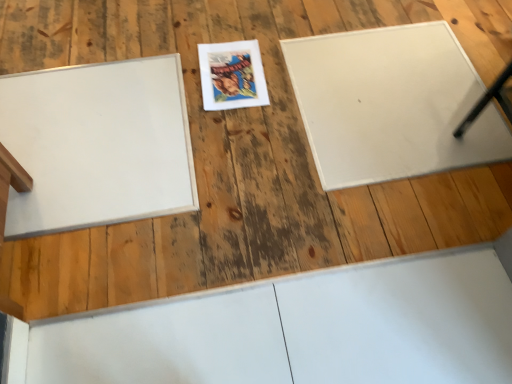
The height and width of the screenshot is (384, 512). What do you see at coordinates (390, 104) in the screenshot?
I see `white matte board at upper right, which is the 2th bulletin board in left-to-right order` at bounding box center [390, 104].

Locate an element on the screen. white matte board at left, which appears as the 2th bulletin board when viewed from the right is located at coordinates (98, 144).

What do you see at coordinates (232, 75) in the screenshot? The width and height of the screenshot is (512, 384). I see `matte paper comic book at center` at bounding box center [232, 75].

In order to face matte paper comic book at center, should I rotate leftwards or rightwards?

A 3.031 degree turn to the left will do.

Locate an element on the screen. This screenshot has height=384, width=512. white matte board at upper right, which is the 2th bulletin board in left-to-right order is located at coordinates (390, 104).

Is white matte board at upper right, which appears as the 1th bulletin board when viewed from the right, not near white matte board at left, which appears as the 2th bulletin board when viewed from the right?

No, white matte board at upper right, which appears as the 1th bulletin board when viewed from the right, is in close proximity to white matte board at left, which appears as the 2th bulletin board when viewed from the right.

Find the location of a particular element. This screenshot has height=384, width=512. bulletin board below the white matte board at upper right, which is the 2th bulletin board in left-to-right order (from the image's perspective) is located at coordinates (98, 144).

Between white matte board at upper right, which appears as the 1th bulletin board when viewed from the right, and white matte board at left, which appears as the 2th bulletin board when viewed from the right, which one has larger size?

With larger size is white matte board at upper right, which appears as the 1th bulletin board when viewed from the right.

From the picture: Does white matte board at upper right, which appears as the 1th bulletin board when viewed from the right, appear on the right side of white matte board at left, which is the first bulletin board in left-to-right order?

Yes.

Can you confirm if matte paper comic book at center is bigger than white matte board at left, which is the first bulletin board in left-to-right order?

Incorrect, matte paper comic book at center is not larger than white matte board at left, which is the first bulletin board in left-to-right order.

What's the angular difference between matte paper comic book at center and white matte board at left, which is the first bulletin board in left-to-right order,'s facing directions?

The facing directions of matte paper comic book at center and white matte board at left, which is the first bulletin board in left-to-right order, are 1.59 degrees apart.

Which object is wider, matte paper comic book at center or white matte board at left, which appears as the 2th bulletin board when viewed from the right?

white matte board at left, which appears as the 2th bulletin board when viewed from the right.

Would you say matte paper comic book at center is a long distance from white matte board at left, which appears as the 2th bulletin board when viewed from the right?

matte paper comic book at center is near white matte board at left, which appears as the 2th bulletin board when viewed from the right, not far away.

Is white matte board at upper right, which appears as the 1th bulletin board when viewed from the right, oriented away from matte paper comic book at center?

That's not correct — white matte board at upper right, which appears as the 1th bulletin board when viewed from the right, is not looking away from matte paper comic book at center.

Which of these two, white matte board at upper right, which is the 2th bulletin board in left-to-right order, or matte paper comic book at center, is wider?

white matte board at upper right, which is the 2th bulletin board in left-to-right order, is wider.

There is a white matte board at upper right, which is the 2th bulletin board in left-to-right order. Find the location of `comic book above it (from a real-world perspective)`. comic book above it (from a real-world perspective) is located at coordinates (232, 75).

What's the angular difference between white matte board at upper right, which appears as the 1th bulletin board when viewed from the right, and matte paper comic book at center's facing directions?

white matte board at upper right, which appears as the 1th bulletin board when viewed from the right, and matte paper comic book at center are facing 2.42 degrees away from each other.

Which is closer to the camera, [227,58] or [343,78]?

The point [343,78] is more forward.

From the image's perspective, is matte paper comic book at center over white matte board at upper right, which is the 2th bulletin board in left-to-right order?

Correct, matte paper comic book at center appears higher than white matte board at upper right, which is the 2th bulletin board in left-to-right order, in the image.

Is there a large distance between matte paper comic book at center and white matte board at upper right, which appears as the 1th bulletin board when viewed from the right?

They are positioned close to each other.

Is white matte board at left, which is the first bulletin board in left-to-right order, at the left side of white matte board at upper right, which appears as the 1th bulletin board when viewed from the right?

Yes, white matte board at left, which is the first bulletin board in left-to-right order, is to the left of white matte board at upper right, which appears as the 1th bulletin board when viewed from the right.

Are white matte board at left, which is the first bulletin board in left-to-right order, and white matte board at upper right, which appears as the 1th bulletin board when viewed from the right, beside each other?

white matte board at left, which is the first bulletin board in left-to-right order, and white matte board at upper right, which appears as the 1th bulletin board when viewed from the right, are clearly separated.

At what (x,y) coordinates should I click in order to perform the action: click on bulletin board on the right side of white matte board at left, which appears as the 2th bulletin board when viewed from the right. Please return your answer as a coordinate pair (x, y). The width and height of the screenshot is (512, 384). Looking at the image, I should click on (390, 104).

Who is bigger, white matte board at left, which is the first bulletin board in left-to-right order, or white matte board at upper right, which is the 2th bulletin board in left-to-right order?

white matte board at upper right, which is the 2th bulletin board in left-to-right order, is bigger.

Between white matte board at left, which appears as the 2th bulletin board when viewed from the right, and matte paper comic book at center, which one is positioned behind?

Positioned behind is matte paper comic book at center.

Are white matte board at left, which is the first bulletin board in left-to-right order, and matte paper comic book at center beside each other?

No.

From the image's perspective, between white matte board at left, which is the first bulletin board in left-to-right order, and matte paper comic book at center, which one is located above?

matte paper comic book at center, from the image's perspective.

Can you confirm if white matte board at left, which appears as the 2th bulletin board when viewed from the right, is wider than matte paper comic book at center?

Correct, the width of white matte board at left, which appears as the 2th bulletin board when viewed from the right, exceeds that of matte paper comic book at center.

Identify the location of bulletin board behind the white matte board at left, which appears as the 2th bulletin board when viewed from the right. (390, 104).

Locate an element on the screen. Image resolution: width=512 pixels, height=384 pixels. bulletin board that is on the left side of matte paper comic book at center is located at coordinates (98, 144).

Based on their spatial positions, is white matte board at left, which appears as the 2th bulletin board when viewed from the right, or matte paper comic book at center closer to white matte board at upper right, which is the 2th bulletin board in left-to-right order?

matte paper comic book at center is positioned closer to the anchor white matte board at upper right, which is the 2th bulletin board in left-to-right order.

Estimate the real-world distances between objects in this image. Which object is closer to white matte board at upper right, which is the 2th bulletin board in left-to-right order, matte paper comic book at center or white matte board at left, which appears as the 2th bulletin board when viewed from the right?

matte paper comic book at center is positioned closer to the anchor white matte board at upper right, which is the 2th bulletin board in left-to-right order.

Looking at the image, which one is located closer to white matte board at left, which is the first bulletin board in left-to-right order, matte paper comic book at center or white matte board at upper right, which appears as the 1th bulletin board when viewed from the right?

matte paper comic book at center is closer to white matte board at left, which is the first bulletin board in left-to-right order.

From the image, which object appears to be farther from matte paper comic book at center, white matte board at left, which is the first bulletin board in left-to-right order, or white matte board at upper right, which is the 2th bulletin board in left-to-right order?

white matte board at upper right, which is the 2th bulletin board in left-to-right order, is positioned further to the anchor matte paper comic book at center.

Looking at the image, which one is located further to matte paper comic book at center, white matte board at upper right, which appears as the 1th bulletin board when viewed from the right, or white matte board at left, which is the first bulletin board in left-to-right order?

white matte board at upper right, which appears as the 1th bulletin board when viewed from the right, is further to matte paper comic book at center.

When comparing their distances from white matte board at left, which is the first bulletin board in left-to-right order, does white matte board at upper right, which is the 2th bulletin board in left-to-right order, or matte paper comic book at center seem further?

white matte board at upper right, which is the 2th bulletin board in left-to-right order.

The height and width of the screenshot is (384, 512). Identify the location of comic book located between white matte board at left, which is the first bulletin board in left-to-right order, and white matte board at upper right, which is the 2th bulletin board in left-to-right order, in the left-right direction. (232, 75).